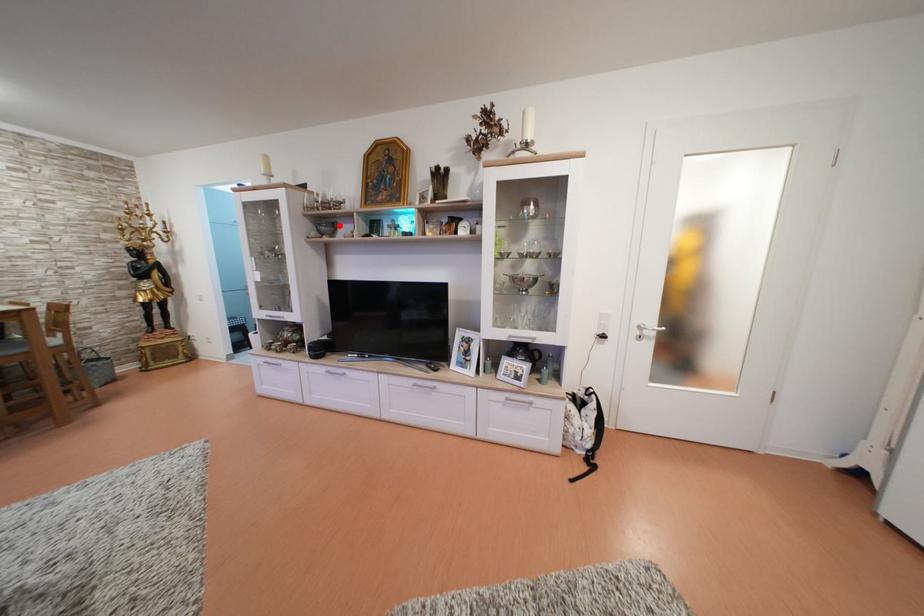
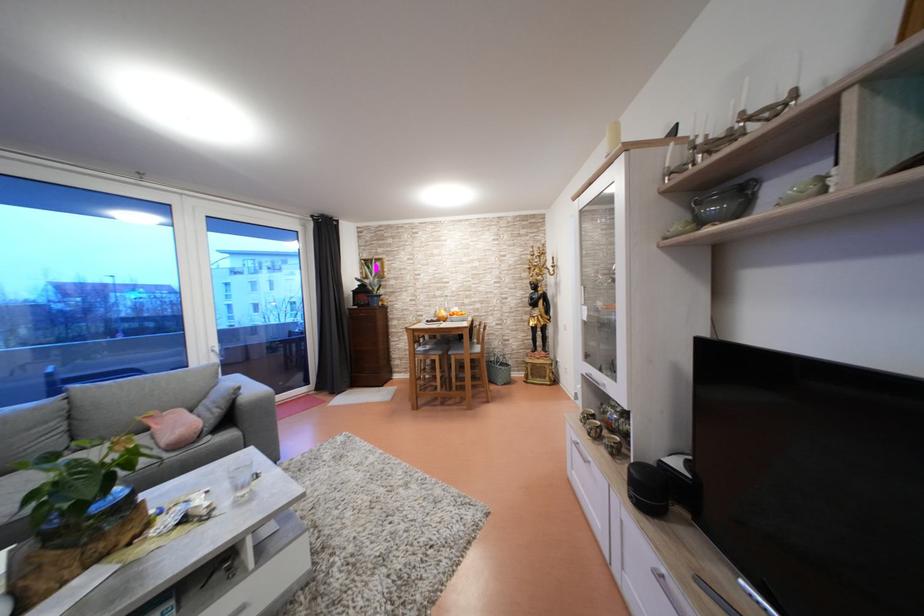
Where in the second image is the point corresponding to the highlighted location from the first image?

(748, 185)